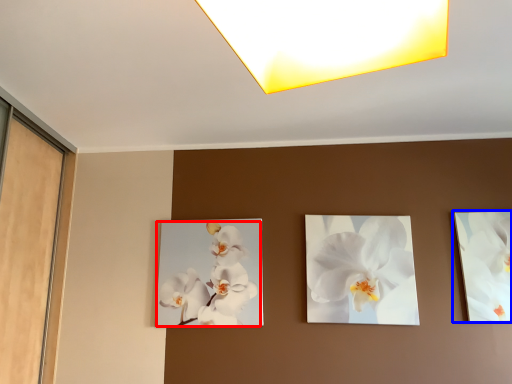
Question: Which point is further to the camera, flower (highlighted by a red box) or picture frame (highlighted by a blue box)?

Choices:
 (A) flower
 (B) picture frame

Answer: (A)